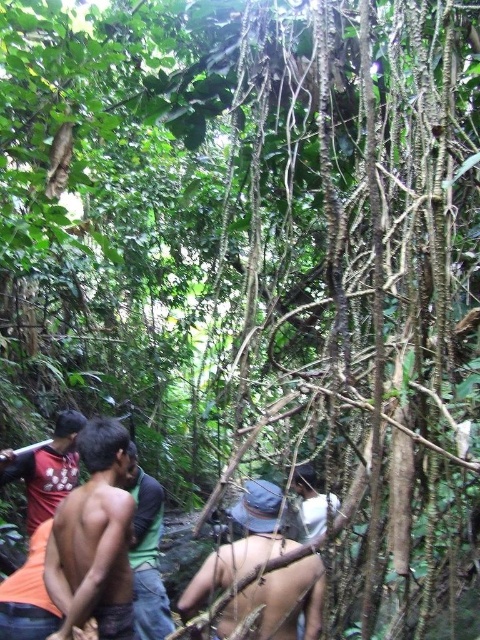
Who is positioned more to the right, matte red shirt at left or white matte shirt at center?

From the viewer's perspective, white matte shirt at center appears more on the right side.

Can you confirm if matte red shirt at left is taller than white matte shirt at center?

Indeed, matte red shirt at left has a greater height compared to white matte shirt at center.

Locate an element on the screen. The height and width of the screenshot is (640, 480). matte red shirt at left is located at coordinates (46, 468).

Is point (233, 612) positioned before point (168, 630)?

Yes.

Does blue fabric hat at center appear under green shirt at center?

Actually, blue fabric hat at center is above green shirt at center.

Locate an element on the screen. blue fabric hat at center is located at coordinates (240, 545).

Measure the distance between point [273,586] and camera.

Point [273,586] is 6.79 feet from camera.

Which is below, blue fabric hat at center or matte red shirt at left?

blue fabric hat at center is lower down.

Who is more forward, (x=241, y=513) or (x=37, y=513)?

Point (x=241, y=513) is in front.

Locate an element on the screen. Image resolution: width=480 pixels, height=640 pixels. blue fabric hat at center is located at coordinates (240, 545).